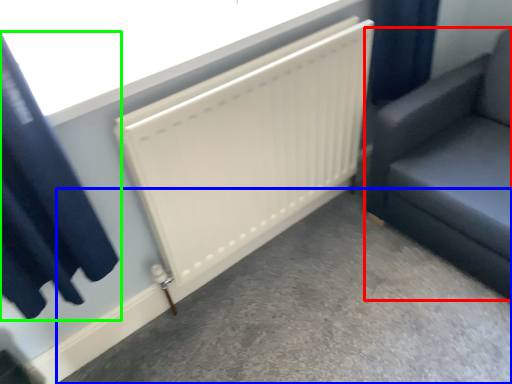
Question: Which object is positioned farthest from furniture (highlighted by a red box)? Select from concrete (highlighted by a blue box) and curtain (highlighted by a green box).

Choices:
 (A) concrete
 (B) curtain

Answer: (B)